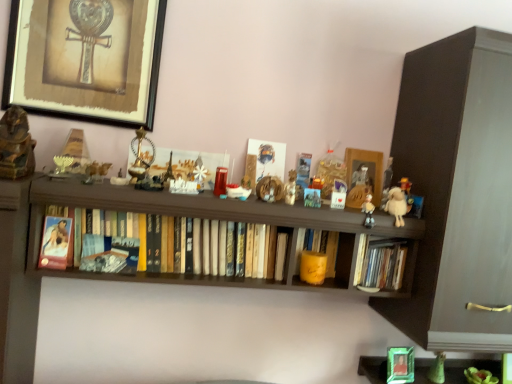
Question: Is hardcover book at center, acting as the first book starting from the right, not inside hardcover books at center, the 1th book positioned from the left?

Choices:
 (A) yes
 (B) no

Answer: (A)

Question: From a real-world perspective, does hardcover book at center, acting as the third book starting from the left, sit lower than hardcover books at center, the 1th book positioned from the left?

Choices:
 (A) no
 (B) yes

Answer: (B)

Question: Does hardcover book at center, acting as the third book starting from the left, have a larger size compared to hardcover books at center, the 1th book positioned from the left?

Choices:
 (A) no
 (B) yes

Answer: (A)

Question: Is hardcover book at center, acting as the third book starting from the left, facing towards hardcover books at center, which is the third book from right to left?

Choices:
 (A) no
 (B) yes

Answer: (A)

Question: Considering the relative sizes of hardcover book at center, acting as the first book starting from the right, and hardcover books at center, the 1th book positioned from the left, in the image provided, is hardcover book at center, acting as the first book starting from the right, wider than hardcover books at center, the 1th book positioned from the left,?

Choices:
 (A) yes
 (B) no

Answer: (B)

Question: Can you confirm if hardcover book at center, acting as the first book starting from the right, is shorter than hardcover books at center, the 1th book positioned from the left?

Choices:
 (A) no
 (B) yes

Answer: (B)

Question: Is metallic framed artwork at upper left, which is counted as the second picture frame, starting from the back, to the right of yellow matte candle at center, which is counted as the 2th book, starting from the right, from the viewer's perspective?

Choices:
 (A) yes
 (B) no

Answer: (B)

Question: Does metallic framed artwork at upper left, which is counted as the second picture frame, starting from the back, appear on the left side of yellow matte candle at center, which is counted as the 2th book, starting from the right?

Choices:
 (A) yes
 (B) no

Answer: (A)

Question: From the image's perspective, is metallic framed artwork at upper left, which is counted as the second picture frame, starting from the back, under yellow matte candle at center, which is counted as the 2th book, starting from the left?

Choices:
 (A) yes
 (B) no

Answer: (B)

Question: From the image's perspective, is metallic framed artwork at upper left, the first picture frame viewed from the front, on top of yellow matte candle at center, which is counted as the 2th book, starting from the right?

Choices:
 (A) no
 (B) yes

Answer: (B)

Question: Can you confirm if metallic framed artwork at upper left, which is counted as the 2th picture frame, starting from the bottom, is smaller than yellow matte candle at center, which is counted as the 2th book, starting from the left?

Choices:
 (A) no
 (B) yes

Answer: (A)

Question: Is metallic framed artwork at upper left, the first picture frame viewed from the front, far from yellow matte candle at center, which is counted as the 2th book, starting from the right?

Choices:
 (A) no
 (B) yes

Answer: (A)

Question: From the image's perspective, is wooden picture frame at center, the 2th picture frame when ordered from front to back, under metallic framed artwork at upper left, the first picture frame viewed from the front?

Choices:
 (A) no
 (B) yes

Answer: (B)